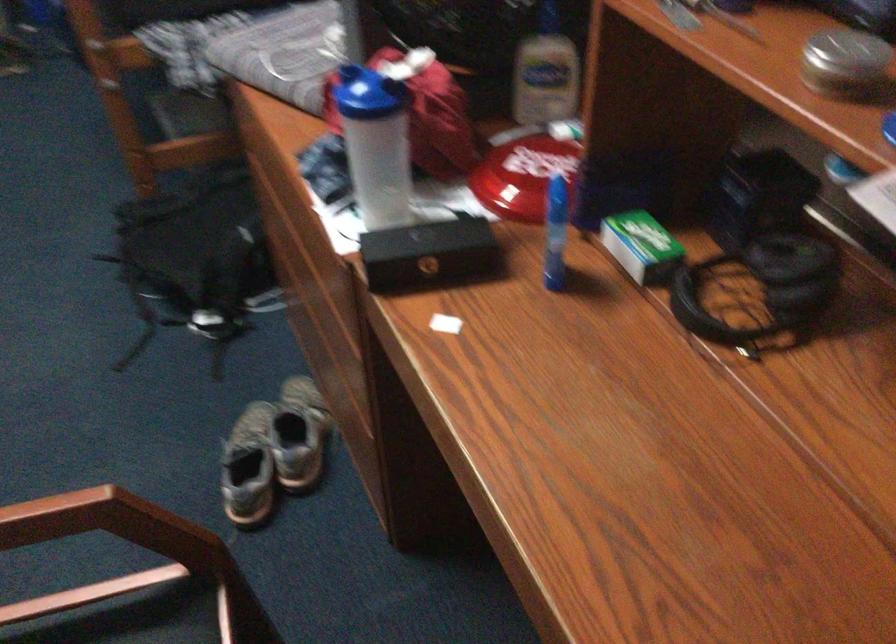
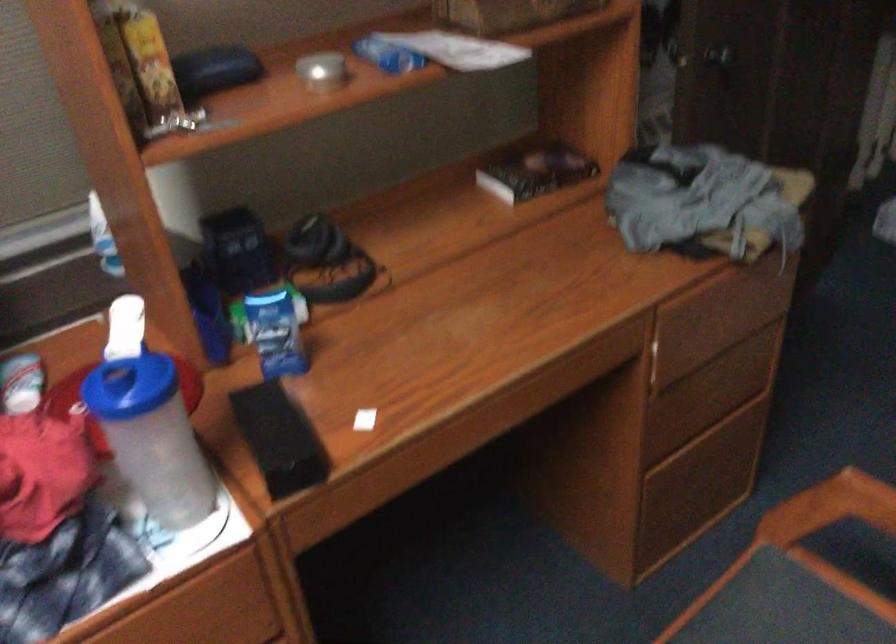
Find the pixel in the second image that matches point 343,97 in the first image.

(130, 386)